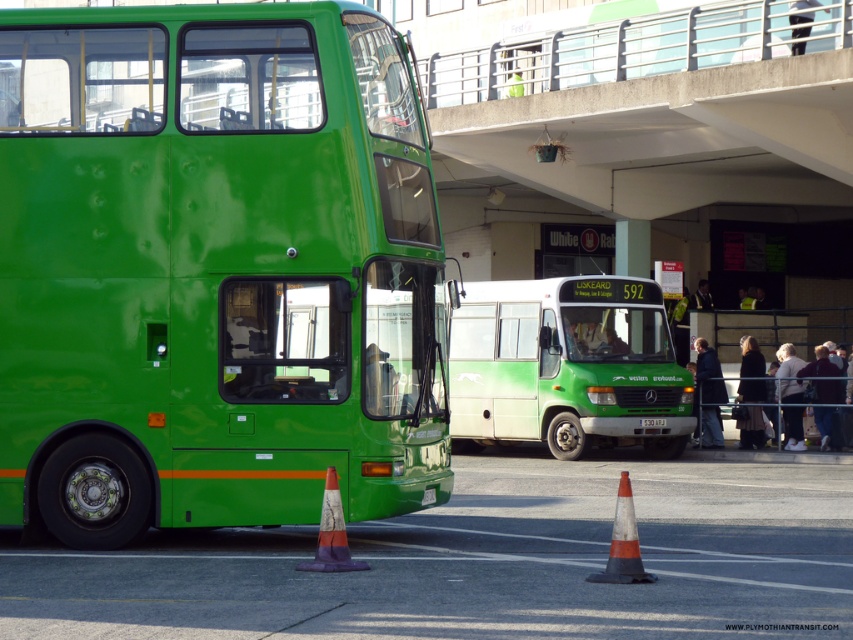
Is green matte bus at left to the right of green plastic license plate at center from the viewer's perspective?

In fact, green matte bus at left is to the left of green plastic license plate at center.

Describe the element at coordinates (213, 269) in the screenshot. I see `green matte bus at left` at that location.

Who is more forward, (3,317) or (640,422)?

Positioned in front is point (3,317).

Find the location of a particular element. The width and height of the screenshot is (853, 640). green matte bus at left is located at coordinates (213, 269).

Which of these two, green matte bus at center or orange and white striped traffic cone at lower center, stands taller?

With more height is green matte bus at center.

This screenshot has height=640, width=853. In order to click on green matte bus at center in this screenshot , I will do `click(566, 365)`.

You are a GUI agent. You are given a task and a screenshot of the screen. Output one action in this format:
    pyautogui.click(x=<x>, y=<y>)
    Task: Click on the green matte bus at center
    This screenshot has height=640, width=853.
    Given the screenshot: What is the action you would take?
    pyautogui.click(x=566, y=365)

Where is `orange and white striped traffic cone at lower center`? The width and height of the screenshot is (853, 640). orange and white striped traffic cone at lower center is located at coordinates (331, 532).

Describe the element at coordinates (331, 532) in the screenshot. I see `orange and white striped traffic cone at lower center` at that location.

At what (x,y) coordinates should I click in order to perform the action: click on orange and white striped traffic cone at lower center. Please return your answer as a coordinate pair (x, y). The height and width of the screenshot is (640, 853). Looking at the image, I should click on (331, 532).